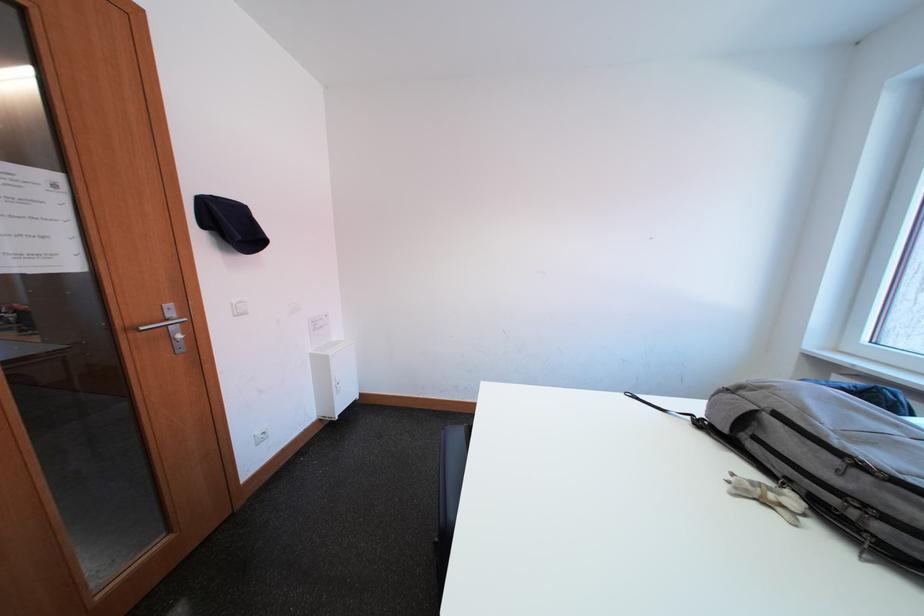
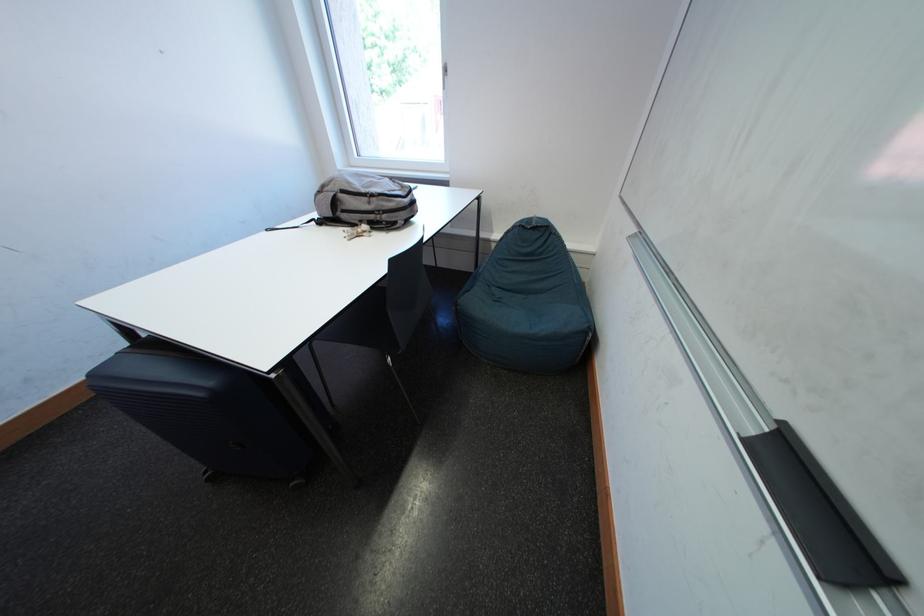
Where in the second image is the point corresponding to point (844, 464) from the first image?

(375, 203)